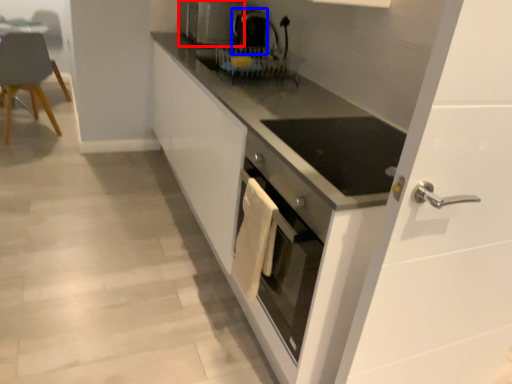
Question: Which object appears closest to the camera in this image, home appliance (highlighted by a red box) or coffee machine (highlighted by a blue box)?

Choices:
 (A) home appliance
 (B) coffee machine

Answer: (B)